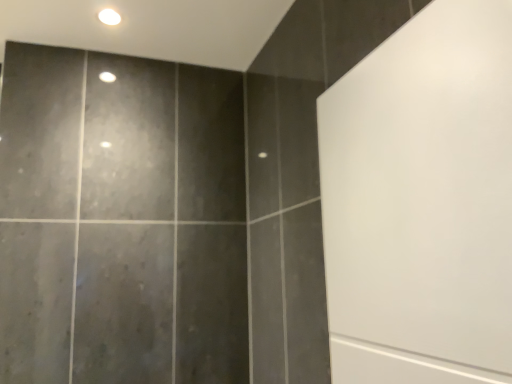
What is the approximate height of white glossy light at upper center?

0.45 inches.

Measure the distance between white glossy light at upper center and camera.

1.27 meters.

What do you see at coordinates (109, 17) in the screenshot? Image resolution: width=512 pixels, height=384 pixels. I see `white glossy light at upper center` at bounding box center [109, 17].

I want to click on white glossy light at upper center, so click(109, 17).

Where is `white glossy light at upper center`? white glossy light at upper center is located at coordinates (109, 17).